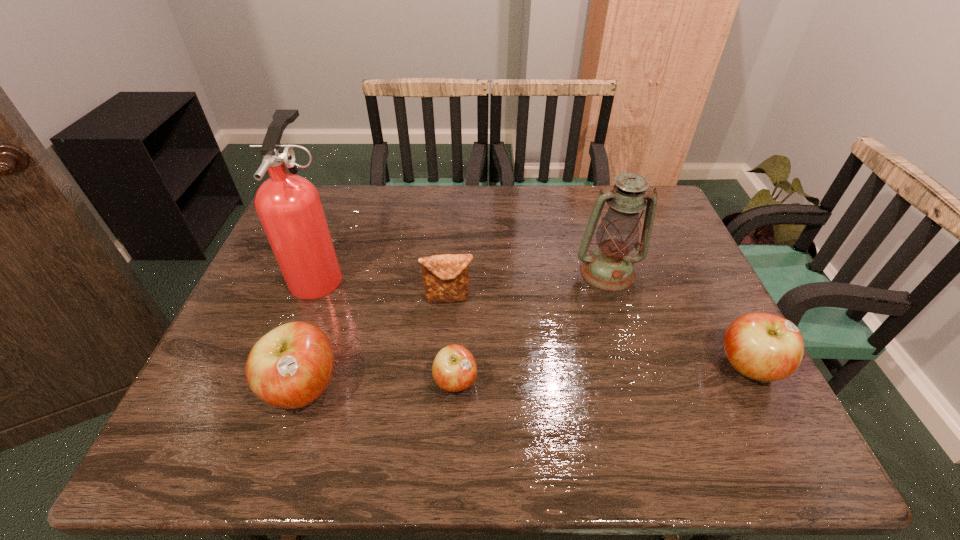
Identify the location of object that is at the near right corner. (765, 347).

The width and height of the screenshot is (960, 540). I want to click on free region at the far edge of the desktop, so click(551, 221).

Locate an element on the screen. This screenshot has width=960, height=540. free space at the near edge is located at coordinates (475, 410).

Locate an element on the screen. The width and height of the screenshot is (960, 540). vacant space at the right edge is located at coordinates (707, 367).

Find the location of a particular element. The image size is (960, 540). free space between the tallest object and the rightmost apple is located at coordinates (534, 321).

I want to click on empty location between the second tallest apple and the clutch bag, so click(x=599, y=333).

The height and width of the screenshot is (540, 960). Identify the location of free space that is in between the leftmost apple and the fifth shortest object. (455, 330).

Identify the location of empty location between the leftmost apple and the second apple from right to left. The height and width of the screenshot is (540, 960). (379, 385).

Identify the location of free area in between the second apple from left to right and the tallest object. This screenshot has width=960, height=540. (388, 328).

Find the location of a particular element. The image size is (960, 540). free space that is in between the leftmost apple and the rightmost object is located at coordinates (526, 378).